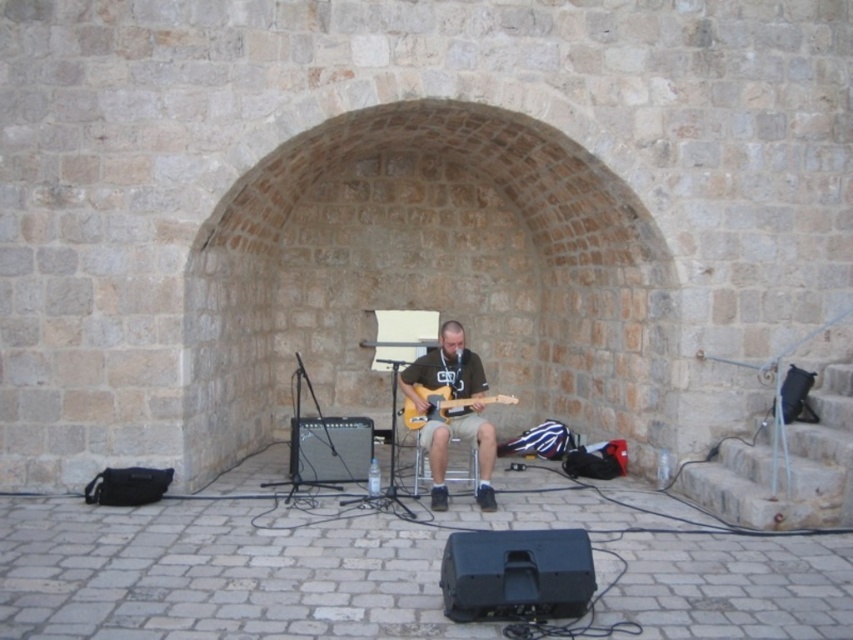
You are a photographer standing at the camera position. You want to take a closeup photo of the matte black guitar at center. Can you move closer to the guitar to get a better shot without moving the guitar itself?

The matte black guitar at center is 6.46 meters from camera, so you can move closer to the guitar to get a better shot without moving the guitar itself since 6.46 meters is a considerable distance allowing for closer approach.

You are a stagehand setting up a new microphone stand for the performer. The current microphone stand is placed directly in front of the matte black guitar at center. If you want to position the new microphone stand 0.1 units to the right of the current one, where should you place it in terms of coordinates?

The current microphone stand is directly in front of the matte black guitar at center located at coordinates point (x=445, y=452). To place the new microphone stand 0.1 units to the right, you would adjust the x coordinate by adding 0.1, resulting in new coordinates of point (x=445, y=516).

From the picture: You are a stagehand setting up equipment for a concert. You need to place both the matte black guitar at center and the light wood electric guitar at center on a shelf that can only hold items up to 1 meter in width. Which guitar should you place first to ensure both fit?

The matte black guitar at center is wider than the light wood electric guitar at center. Since the shelf can hold up to 1 meter, you should place the wider matte black guitar at center first to ensure both fit within the width limit.